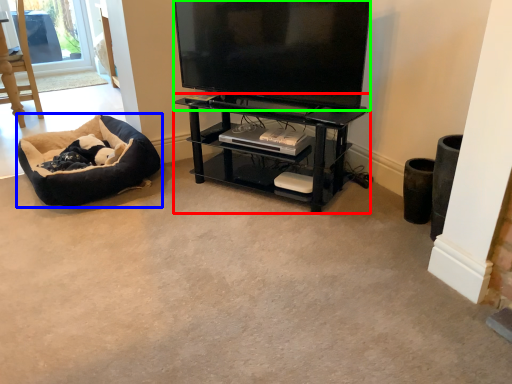
Question: Based on their relative distances, which object is farther from shelf (highlighted by a red box)? Choose from dog bed (highlighted by a blue box) and television (highlighted by a green box).

Choices:
 (A) dog bed
 (B) television

Answer: (A)